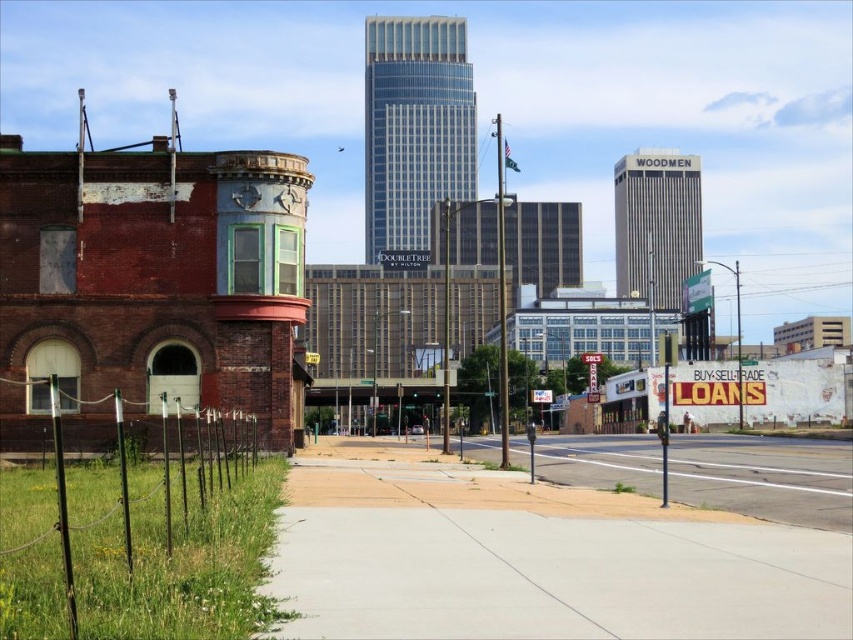
Question: Can you confirm if gray concrete sidewalk at center is wider than transparent glass skyscraper at center?

Choices:
 (A) yes
 (B) no

Answer: (B)

Question: Which object is the farthest from the gray concrete sidewalk at center?

Choices:
 (A) gray concrete skyscraper at center
 (B) transparent glass skyscraper at center

Answer: (B)

Question: Does gray concrete sidewalk at center appear on the right side of transparent glass skyscraper at center?

Choices:
 (A) no
 (B) yes

Answer: (B)

Question: Can you confirm if gray concrete sidewalk at center is positioned below transparent glass skyscraper at center?

Choices:
 (A) no
 (B) yes

Answer: (B)

Question: Which object is positioned farthest from the gray concrete skyscraper at center?

Choices:
 (A) transparent glass skyscraper at center
 (B) gray concrete sidewalk at center

Answer: (B)

Question: Which object appears farthest from the camera in this image?

Choices:
 (A) gray concrete sidewalk at center
 (B) gray concrete skyscraper at center

Answer: (B)